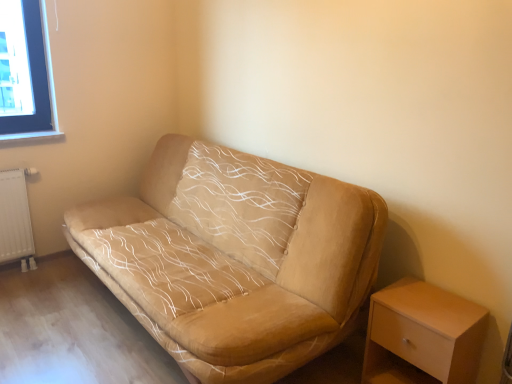
Locate an element on the screen. free location in front of white textured radiator at lower left is located at coordinates (20, 282).